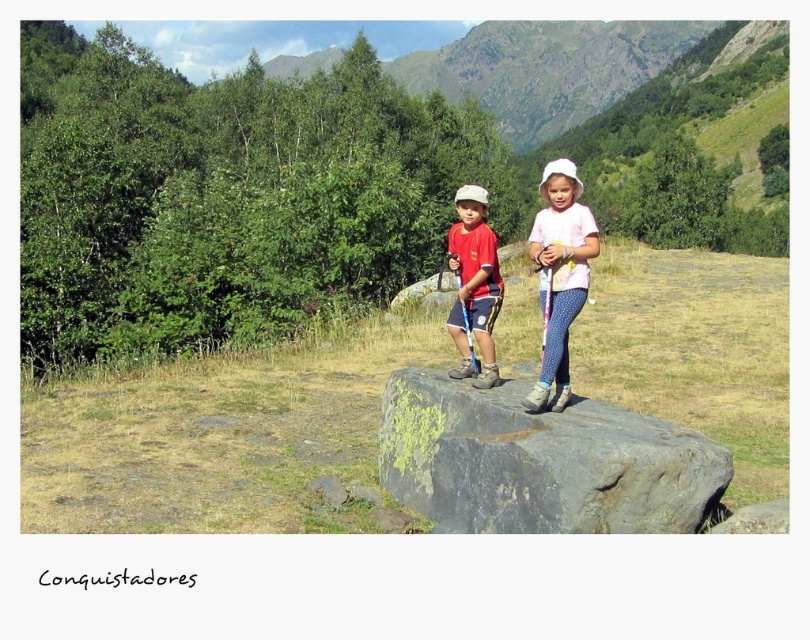
Question: Which point is farther to the camera?

Choices:
 (A) coord(621,433)
 (B) coord(497,308)
 (C) coord(583,253)

Answer: (B)

Question: From the image, what is the correct spatial relationship of gray rough boulder at center in relation to white dotted leggings at center?

Choices:
 (A) above
 (B) below

Answer: (B)

Question: Which point is farther from the camera taking this photo?

Choices:
 (A) (555, 513)
 (B) (480, 266)

Answer: (B)

Question: Is gray rough boulder at center further to the viewer compared to matte red shirt at center?

Choices:
 (A) no
 (B) yes

Answer: (A)

Question: Which of the following is the closest to the observer?

Choices:
 (A) white dotted leggings at center
 (B) matte red shirt at center
 (C) gray rough boulder at center

Answer: (C)

Question: Does white dotted leggings at center come in front of matte red shirt at center?

Choices:
 (A) no
 (B) yes

Answer: (B)